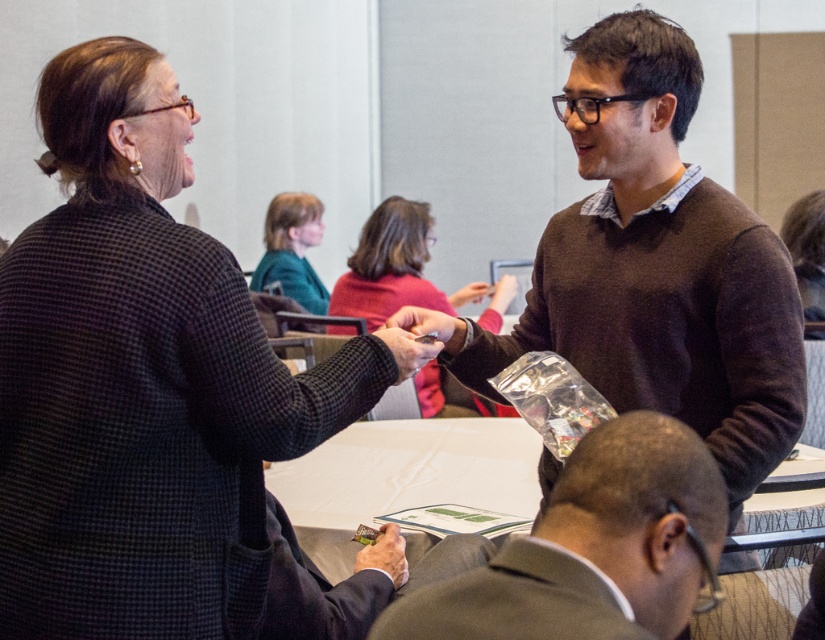
Which is behind, point (408, 221) or point (328, 292)?

The point (328, 292) is behind.

Where is `matte red sweater at center`? matte red sweater at center is located at coordinates (392, 266).

You are a GUI agent. You are given a task and a screenshot of the screen. Output one action in this format:
    pyautogui.click(x=<x>, y=<y>)
    Task: Click on the matte red sweater at center
    This screenshot has height=640, width=825.
    Given the screenshot: What is the action you would take?
    pyautogui.click(x=392, y=266)

Who is positioned more to the right, gray suit jacket at lower center or matte red sweater at center?

gray suit jacket at lower center

This screenshot has width=825, height=640. I want to click on gray suit jacket at lower center, so click(592, 547).

Where is `gray suit jacket at lower center`? gray suit jacket at lower center is located at coordinates (592, 547).

Who is shorter, black textured coat at upper left or brown sweater at upper right?

With less height is black textured coat at upper left.

Who is positioned more to the right, black textured coat at upper left or brown sweater at upper right?

From the viewer's perspective, brown sweater at upper right appears more on the right side.

Describe the element at coordinates (144, 380) in the screenshot. The height and width of the screenshot is (640, 825). I see `black textured coat at upper left` at that location.

Find the location of a particular element. This screenshot has height=640, width=825. black textured coat at upper left is located at coordinates (144, 380).